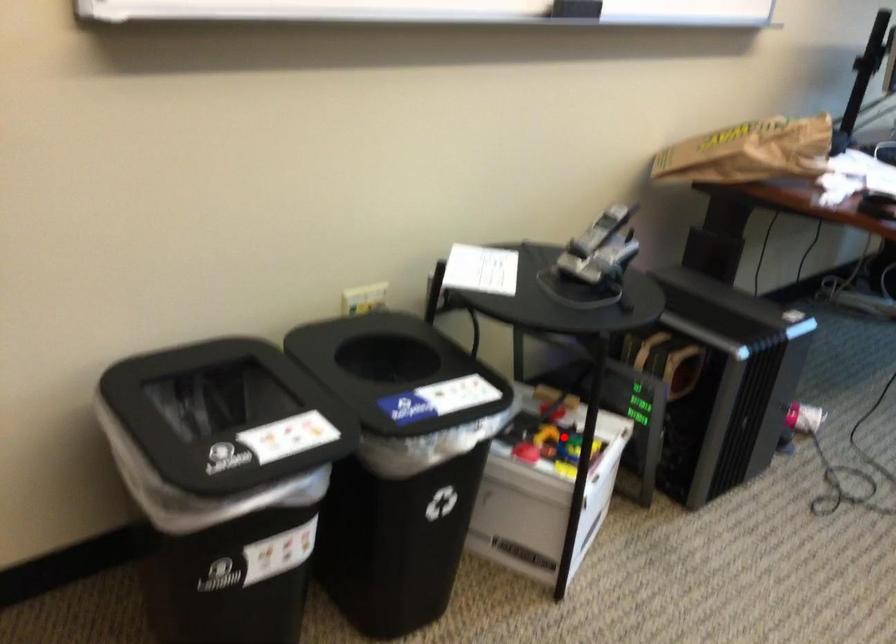
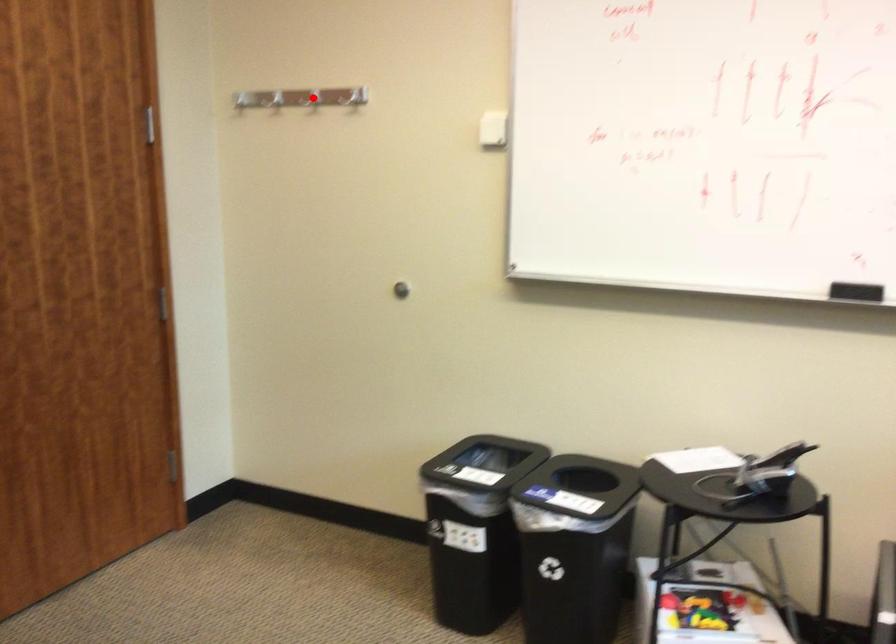
I am providing you with two images of the same scene from different viewpoints. A red point is marked on the first image and another point is marked on the second image. Is the marked point in image1 the same physical position as the marked point in image2?

No